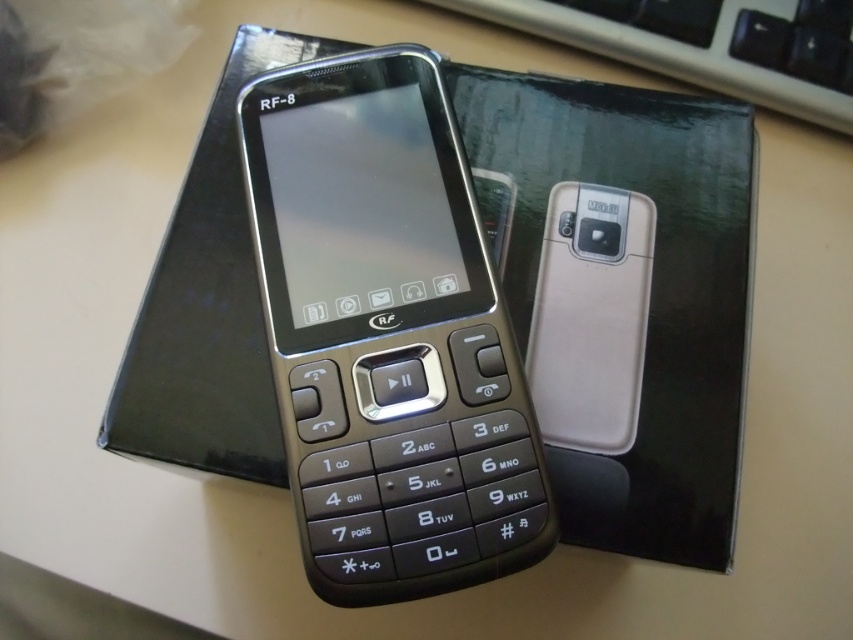
You are holding the RF8 phone and want to place it back into its original packaging. The packaging has a slot designed to hold the phone vertically. However, you notice that the matte black phone at center and the black plastic keyboard at upper center are currently positioned in a way that might block the slot. Based on their current positions, can you determine if the phone will fit into the slot without adjusting their positions?

The matte black phone at center is below the black plastic keyboard at upper center. Since the phone is positioned below the keyboard, it is already aligned vertically and should fit into the packaging slot without needing adjustments.

You are holding the RF8 phone and want to press the button located at point (399, 109). However, there is an obstruction at point (509, 8). Can you press the desired button without moving the obstruction?

Point (399, 109) is in front of point (509, 8), so yes, you can press the button at point (399, 109) without moving the obstruction at point (509, 8) because it is behind the desired button.